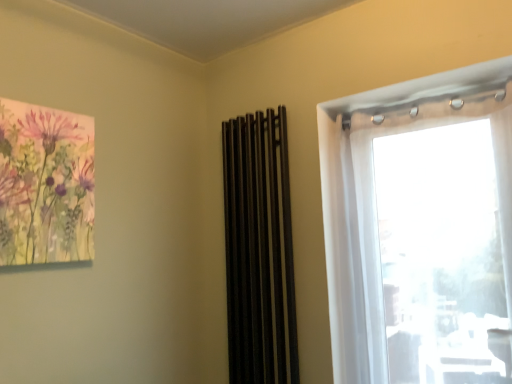
Question: Which is correct: black matte curtain at center is inside transparent fabric at right, or outside of it?

Choices:
 (A) inside
 (B) outside

Answer: (B)

Question: In the image, is black matte curtain at center positioned in front of or behind transparent fabric at right?

Choices:
 (A) front
 (B) behind

Answer: (B)

Question: Is point (249, 208) positioned closer to the camera than point (384, 233)?

Choices:
 (A) farther
 (B) closer

Answer: (A)

Question: Would you say transparent fabric at right is to the left or to the right of black matte curtain at center in the picture?

Choices:
 (A) right
 (B) left

Answer: (A)

Question: From the image's perspective, is transparent fabric at right above or below black matte curtain at center?

Choices:
 (A) below
 (B) above

Answer: (B)

Question: Considering the positions of transparent fabric at right and black matte curtain at center in the image, is transparent fabric at right taller or shorter than black matte curtain at center?

Choices:
 (A) tall
 (B) short

Answer: (B)

Question: Is transparent fabric at right in front of or behind black matte curtain at center in the image?

Choices:
 (A) behind
 (B) front

Answer: (B)